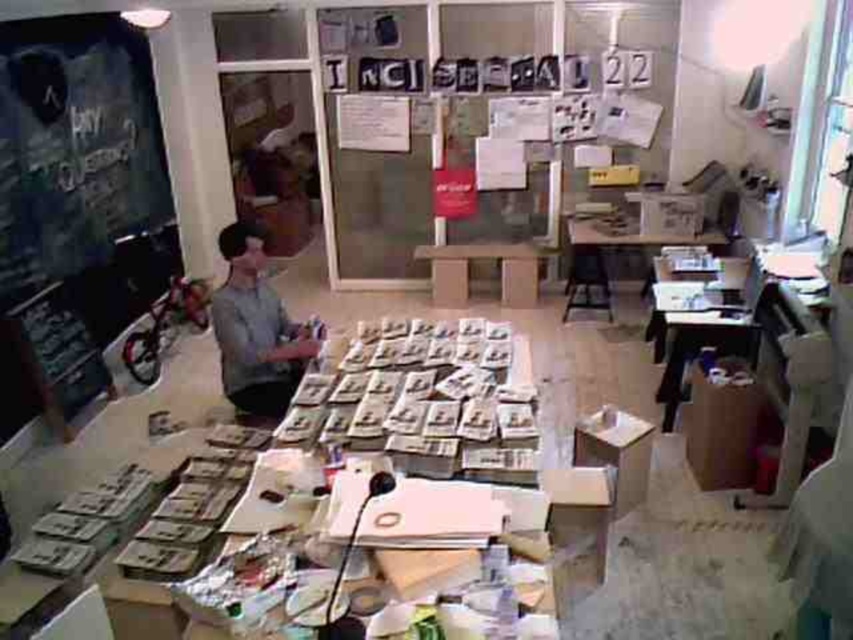
Question: Which point is farther to the camera?

Choices:
 (A) denim fabric bulletin board at left
 (B) wooden table at center

Answer: (B)

Question: Which object is positioned closest to the gray matte shirt at center?

Choices:
 (A) matte wood table at center
 (B) wooden table at center
 (C) denim fabric bulletin board at left

Answer: (C)

Question: Is gray matte shirt at center above wooden table at center?

Choices:
 (A) no
 (B) yes

Answer: (A)

Question: Does denim fabric bulletin board at left have a smaller size compared to wooden table at center?

Choices:
 (A) no
 (B) yes

Answer: (A)

Question: Is denim fabric bulletin board at left closer to camera compared to wooden table at center?

Choices:
 (A) no
 (B) yes

Answer: (B)

Question: Which object is closer to the camera taking this photo?

Choices:
 (A) denim fabric bulletin board at left
 (B) gray matte shirt at center

Answer: (B)